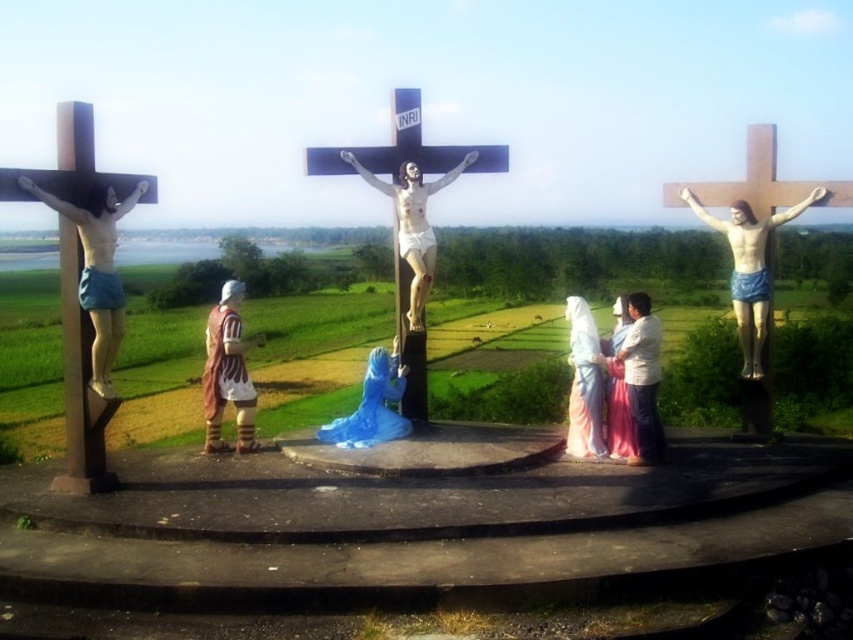
You are an art restorer examining a religious painting. You need to determine the placement of two items in the scene. The wooden statue of jesus at right and the smooth pink fabric at center are both present. Based on their sizes, which item is taller?

The wooden statue of jesus at right is taller than the smooth pink fabric at center.

You are an observer standing in front of the three crosses in the religious scene. You notice two specific points marked as point 1 at coordinates point (x=242, y=340) and point 2 at coordinates point (x=576, y=442). Which point is closer to your viewpoint?

Point (x=242, y=340) is closer to the camera than point (x=576, y=442).

You are an observer standing in front of the religious scene. You notice the brown leather armor at center left and the smooth pink fabric at center. Which object is positioned to the right of the other?

The smooth pink fabric at center is to the right of the brown leather armor at center left.